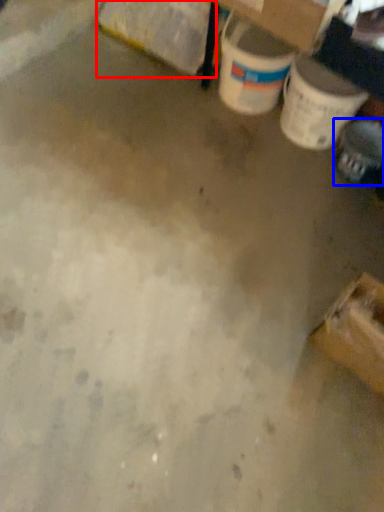
Question: Among these objects, which one is nearest to the camera, cardboard box (highlighted by a red box) or footwear (highlighted by a blue box)?

Choices:
 (A) cardboard box
 (B) footwear

Answer: (B)